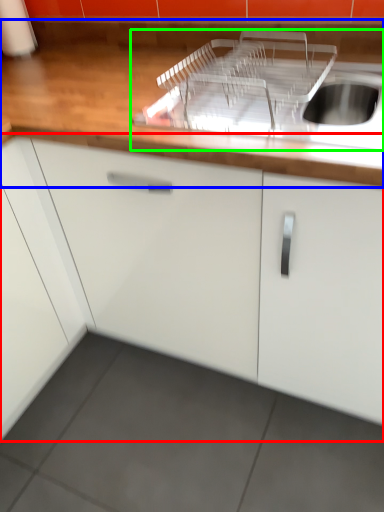
Question: Based on their relative distances, which object is farther from cabinetry (highlighted by a red box)? Choose from countertop (highlighted by a blue box) and sink (highlighted by a green box).

Choices:
 (A) countertop
 (B) sink

Answer: (B)